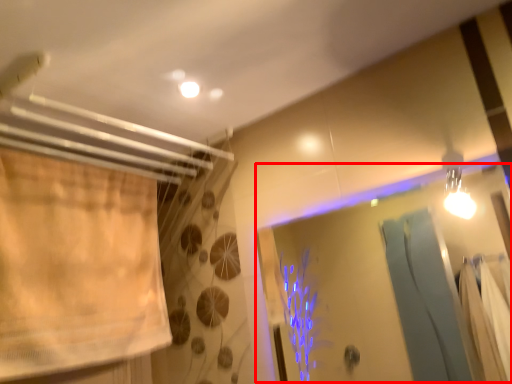
Question: Where is screen door (annotated by the red box) located in relation to curtain in the image?

Choices:
 (A) left
 (B) right

Answer: (B)